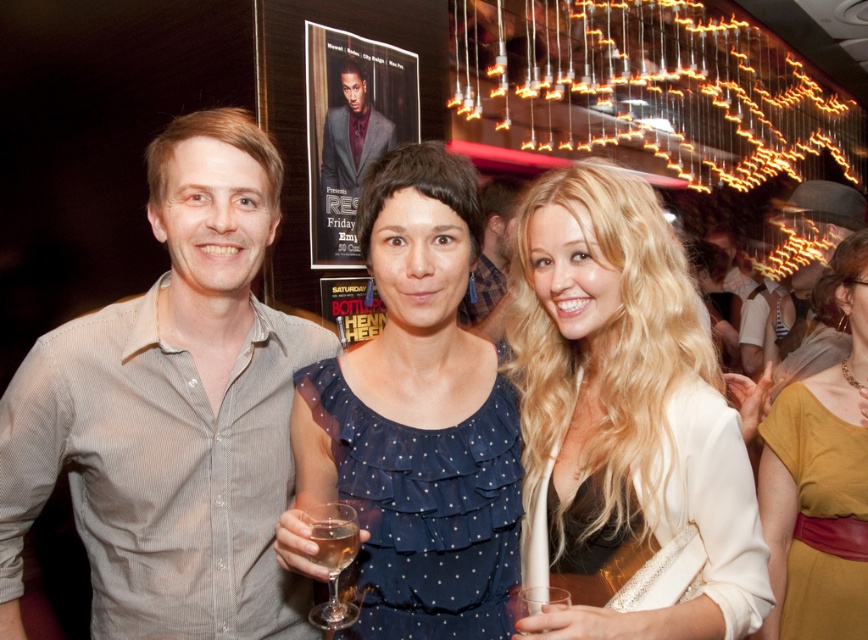
Question: Is smooth gray suit at center wider than light brown leather hat at upper right?

Choices:
 (A) no
 (B) yes

Answer: (A)

Question: Estimate the real-world distances between objects in this image. Which object is farther from the blue dotted fabric dress at center?

Choices:
 (A) clear glass wine at center
 (B) matte gray shirt at center

Answer: (B)

Question: Is blonde hair at center below matte gray shirt at center?

Choices:
 (A) no
 (B) yes

Answer: (B)

Question: Is mustard yellow fabric at center to the left of smooth gray suit at center from the viewer's perspective?

Choices:
 (A) no
 (B) yes

Answer: (A)

Question: Which object is closer to the camera taking this photo?

Choices:
 (A) smooth gray suit at center
 (B) clear glass wine glass at center
 (C) blonde hair at center
 (D) mustard yellow fabric at center

Answer: (C)

Question: Based on their relative distances, which object is nearer to the mustard yellow fabric at center?

Choices:
 (A) clear glass wine at center
 (B) blue dotted fabric dress at center

Answer: (B)